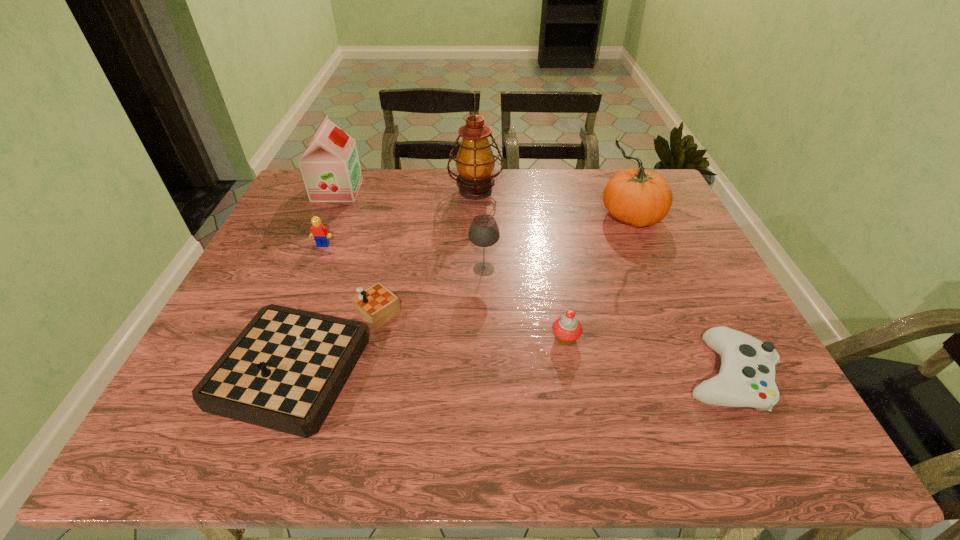
Locate an element on the screen. This screenshot has width=960, height=540. chessboard positioned at the near edge is located at coordinates (284, 371).

At what (x,y) coordinates should I click in order to perform the action: click on control present at the near edge. Please return your answer as a coordinate pair (x, y). Image resolution: width=960 pixels, height=540 pixels. Looking at the image, I should click on (746, 378).

In order to click on soya milk that is at the left edge in this screenshot , I will do `click(330, 167)`.

At what (x,y) coordinates should I click in order to perform the action: click on Lego at the left edge. Please return your answer as a coordinate pair (x, y). The image size is (960, 540). Looking at the image, I should click on (319, 232).

Locate an element on the screen. The image size is (960, 540). chessboard present at the left edge is located at coordinates (284, 371).

Locate an element on the screen. This screenshot has width=960, height=540. pumpkin that is positioned at the right edge is located at coordinates pos(637,196).

Identify the location of control at the right edge. The height and width of the screenshot is (540, 960). (746, 378).

Where is `object that is at the far left corner`? The width and height of the screenshot is (960, 540). object that is at the far left corner is located at coordinates (330, 167).

Locate an element on the screen. object at the near left corner is located at coordinates (284, 371).

The height and width of the screenshot is (540, 960). I want to click on object situated at the far right corner, so click(637, 196).